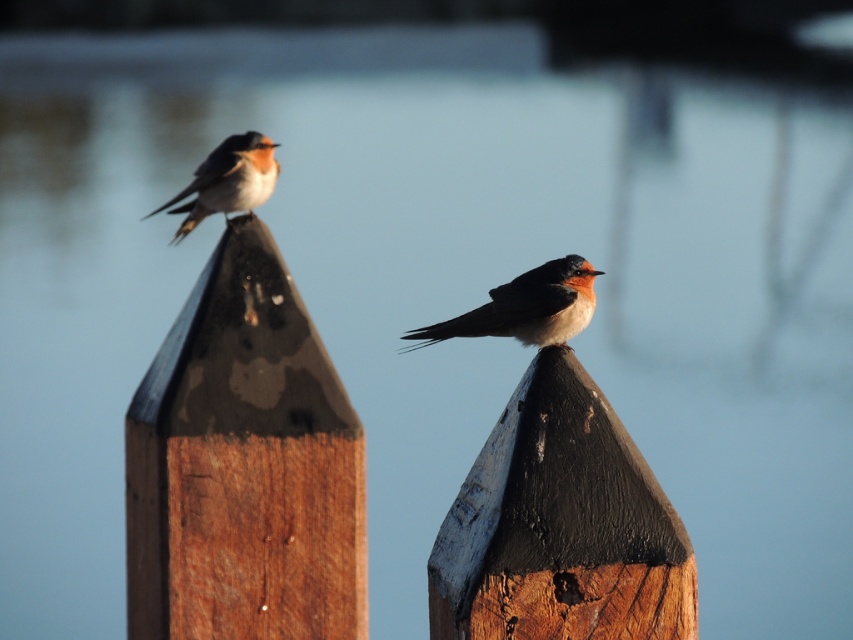
You are a photographer trying to capture the orange feathers of the bird at the center of the image. The camera focuses on the point at coordinates (526, 307). Will the orange feathers at center be in focus?

The orange feathers at center are located at point (526, 307), so yes, the camera will focus on the orange feathers at center.

You are standing in front of the scene with two birds on wooden posts. You notice a painted wood post at center. Can you determine its exact 2D coordinates based on the scene?

The painted wood post at center is located at the 2D coordinates point (x=560, y=525).